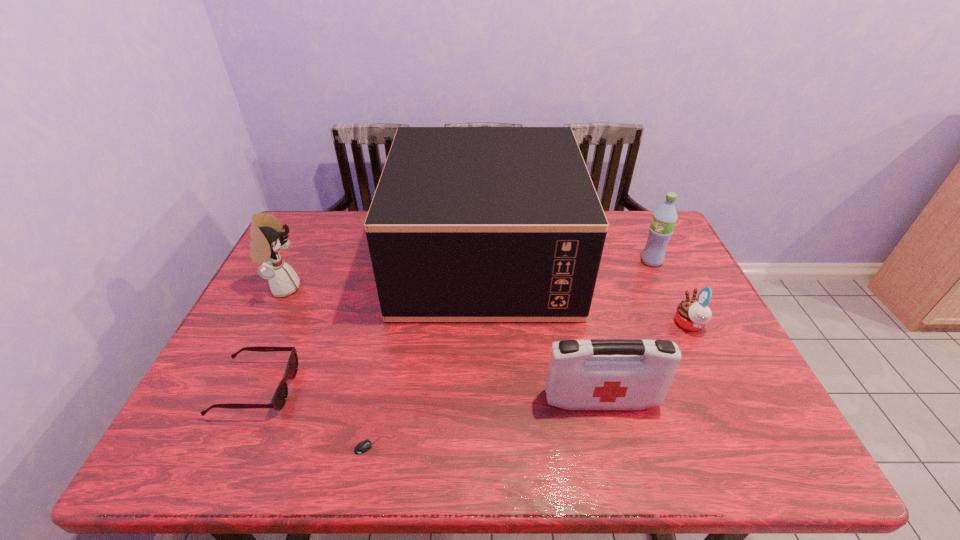
In order to click on object identified as the second closest to the fourth shortest object in this screenshot , I will do `click(467, 224)`.

Point out which object is positioned as the fifth nearest to the tallest object. Please provide its 2D coordinates. Your answer should be formatted as a tuple, i.e. [(x, y)], where the tuple contains the x and y coordinates of a point satisfying the conditions above.

[(267, 236)]

Find the location of a particular element. The image size is (960, 540). vacant space that satisfies the following two spatial constraints: 1. at the front lenses of the shortest object; 2. on the right side of the sixth tallest object is located at coordinates (230, 445).

The height and width of the screenshot is (540, 960). Identify the location of free space in the image that satisfies the following two spatial constraints: 1. on the back side of the water bottle; 2. on the front-facing side of the tallest object. (651, 259).

Locate an element on the screen. Image resolution: width=960 pixels, height=540 pixels. vacant space that satisfies the following two spatial constraints: 1. on the front side of the water bottle; 2. at the front lenses of the sunglasses is located at coordinates (710, 388).

In order to click on free region that satisfies the following two spatial constraints: 1. at the front lenses of the sunglasses; 2. on the right side of the mouse in this screenshot , I will do `click(230, 445)`.